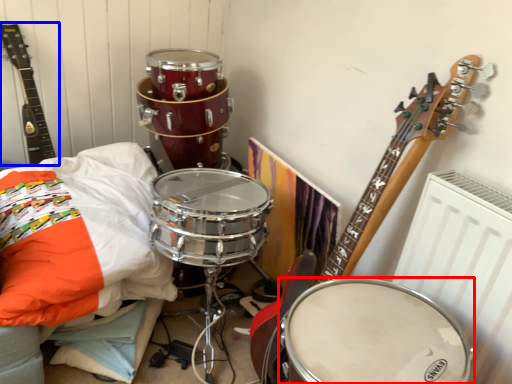
Question: Which object is further to the camera taking this photo, drum (highlighted by a red box) or guitar (highlighted by a blue box)?

Choices:
 (A) drum
 (B) guitar

Answer: (B)